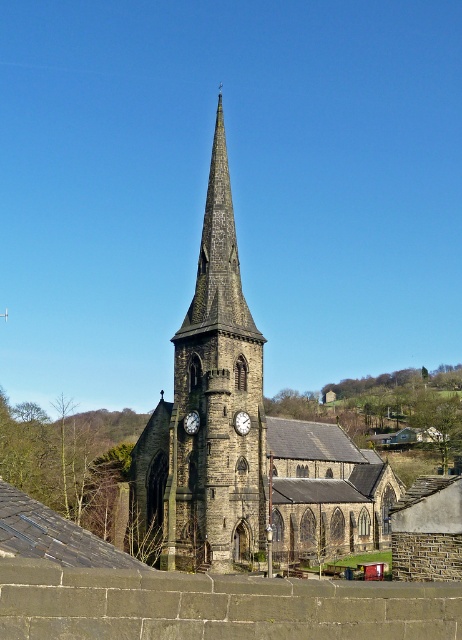
You are a photographer planning to capture a photo of the dark stone church at center and the metallic clock at center. Given their height difference, which object should you position closer to the camera to ensure both are fully visible in the frame?

Since the dark stone church at center is much taller than the metallic clock at center, you should position the metallic clock at center closer to the camera to balance their sizes in the photo.

You are standing at point (245, 435) in the image. What structure are you closest to?

You are closest to the dark stone church at center because point (245, 435) is on it.